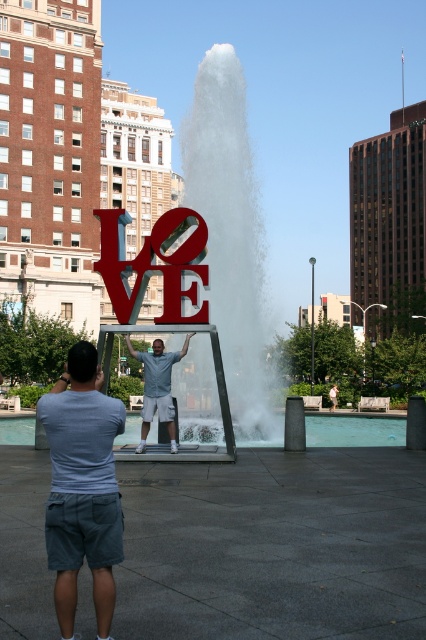
Is point (49, 452) farther from camera compared to point (149, 403)?

No, it is not.

Does gray cotton shorts at lower left have a greater height compared to light blue shirt at center?

Incorrect, gray cotton shorts at lower left's height is not larger of light blue shirt at center's.

Is point (112, 541) closer to viewer compared to point (160, 404)?

Yes, point (112, 541) is closer to viewer.

The width and height of the screenshot is (426, 640). What are the coordinates of `gray cotton shorts at lower left` in the screenshot? It's located at (83, 486).